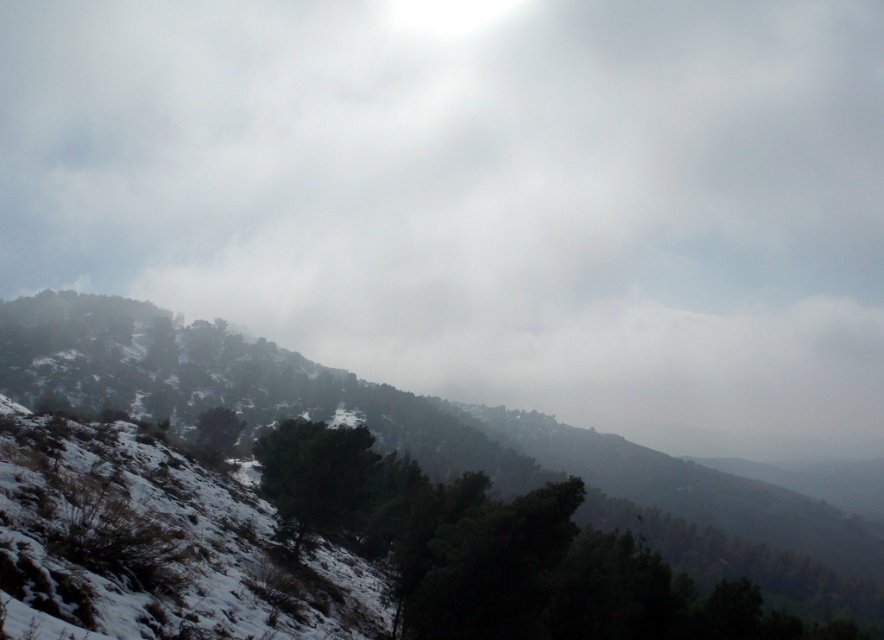
Question: Which object appears closest to the camera in this image?

Choices:
 (A) snowy forested hillside at upper left
 (B) white fluffy cloud at upper center

Answer: (A)

Question: Considering the relative positions of white fluffy cloud at upper center and snowy forested hillside at upper left in the image provided, where is white fluffy cloud at upper center located with respect to snowy forested hillside at upper left?

Choices:
 (A) above
 (B) below

Answer: (A)

Question: Does white fluffy cloud at upper center have a smaller size compared to snowy forested hillside at upper left?

Choices:
 (A) yes
 (B) no

Answer: (B)

Question: Can you confirm if white fluffy cloud at upper center is wider than snowy forested hillside at upper left?

Choices:
 (A) yes
 (B) no

Answer: (A)